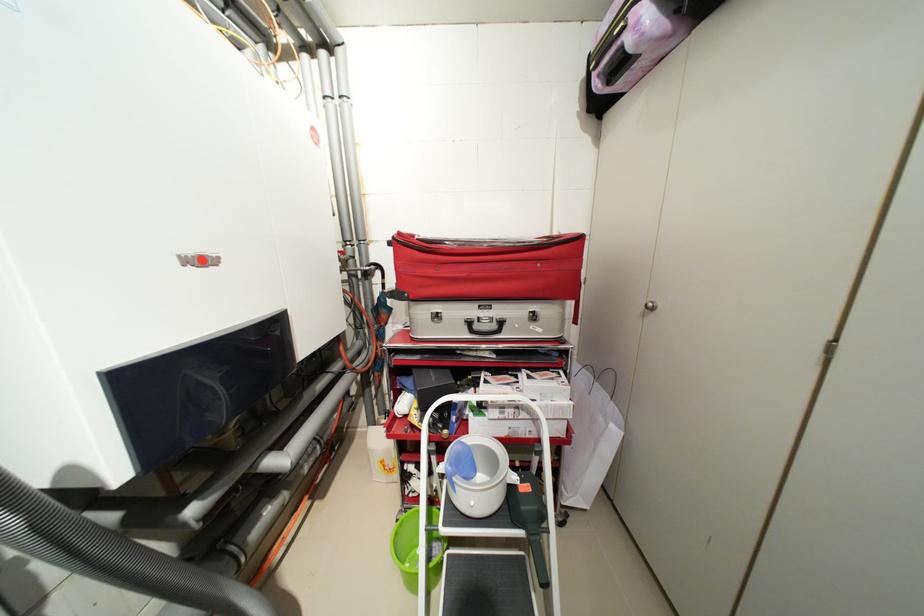
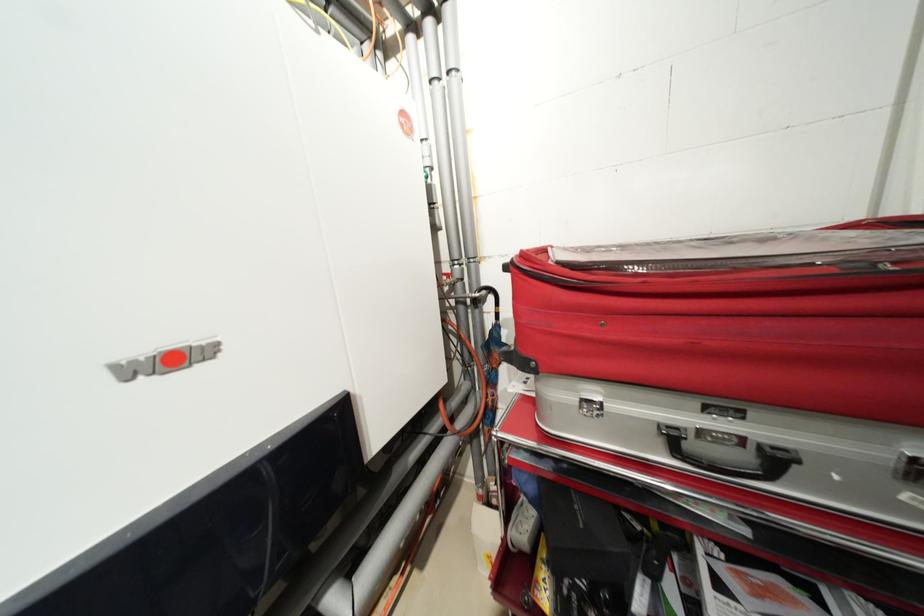
Question: Which direction would the cameraman need to move to produce the second image? Reply with the corresponding letter.

Choices:
 (A) Left
 (B) Right
 (C) Forward
 (D) Backward

Answer: (C)